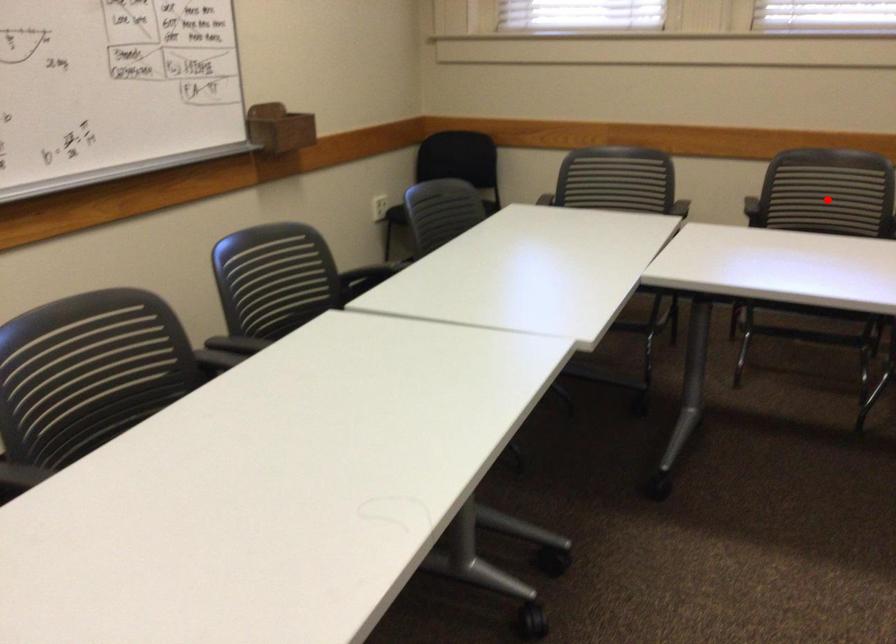
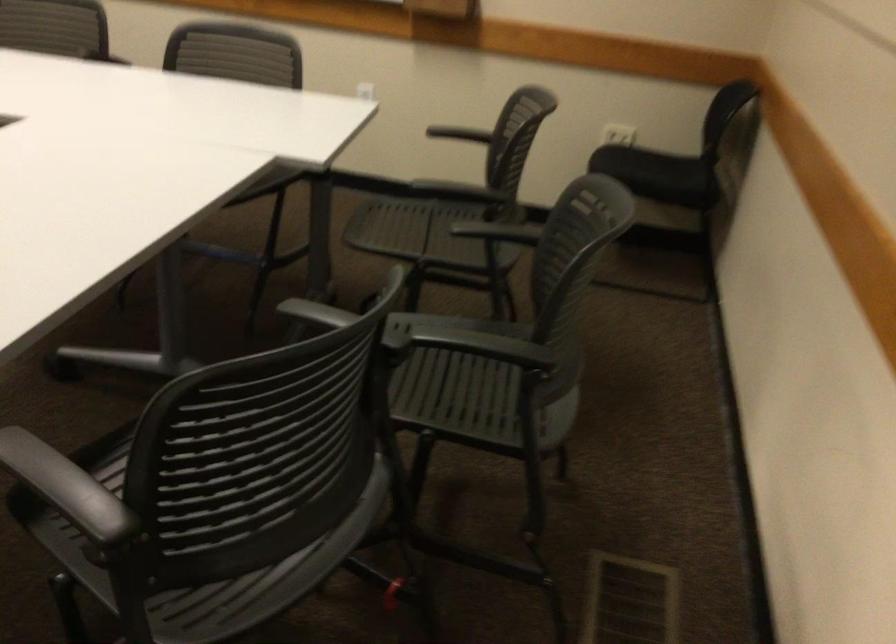
Question: I am providing you with two images of the same scene from different viewpoints. A red point is marked on the first image. At the location where the point appears in image 1, is it still visible in image 2?

Choices:
 (A) Yes
 (B) No

Answer: (B)